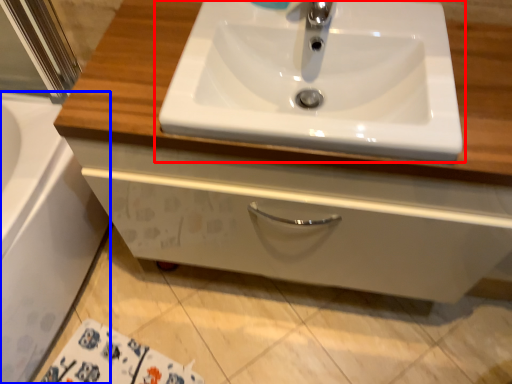
Question: Among these objects, which one is farthest to the camera, sink (highlighted by a red box) or bath (highlighted by a blue box)?

Choices:
 (A) sink
 (B) bath

Answer: (B)